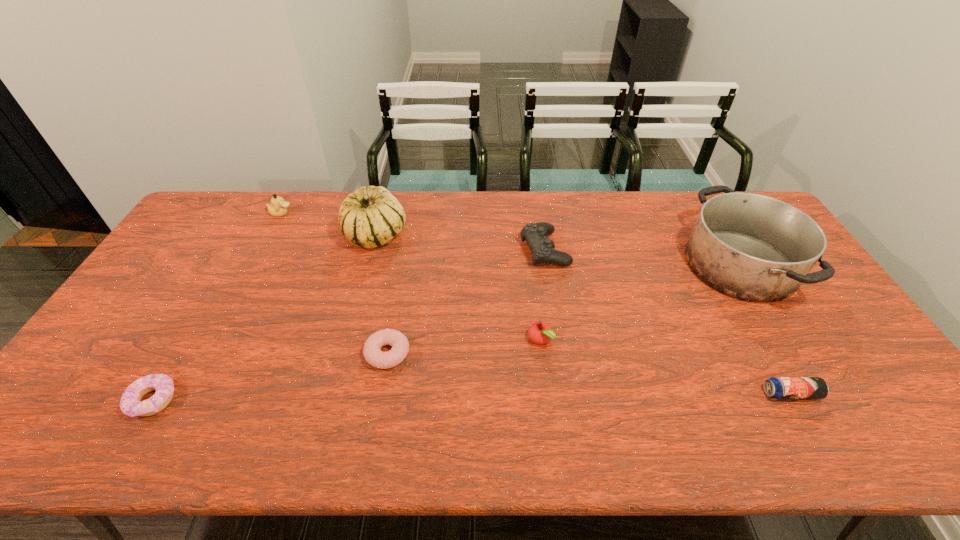
Identify the location of empty location between the duckling and the control. (413, 232).

Identify the location of free space that is in between the beer can and the farther doughnut. (588, 374).

Locate an element on the screen. vacant space that is in between the control and the saucepan is located at coordinates (642, 257).

At what (x,y) coordinates should I click in order to perform the action: click on free point between the gourd and the beer can. Please return your answer as a coordinate pair (x, y). The image size is (960, 540). Looking at the image, I should click on (584, 314).

Find the location of a particular element. free area in between the control and the duckling is located at coordinates (413, 232).

You are a GUI agent. You are given a task and a screenshot of the screen. Output one action in this format:
    pyautogui.click(x=<x>, y=<y>)
    Task: Click on the free space between the saucepan and the beer can
    
    Given the screenshot: What is the action you would take?
    pyautogui.click(x=765, y=329)

Find the location of `empty space between the duckling and the saucepan`. empty space between the duckling and the saucepan is located at coordinates (511, 239).

At what (x,y) coordinates should I click in order to perform the action: click on object identified as the sixth closest to the duckling. Please return your answer as a coordinate pair (x, y). This screenshot has height=540, width=960. Looking at the image, I should click on (751, 247).

Choose which object is the sixth nearest neighbor to the gourd. Please provide its 2D coordinates. Your answer should be formatted as a tuple, i.e. [(x, y)], where the tuple contains the x and y coordinates of a point satisfying the conditions above.

[(751, 247)]

This screenshot has width=960, height=540. What are the coordinates of `free space in the image that satisfies the following two spatial constraints: 1. on the back side of the farther doughnut; 2. on the left side of the saucepan` in the screenshot? It's located at (403, 265).